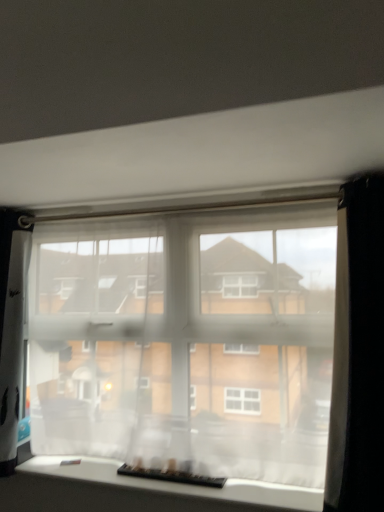
At what (x,y) coordinates should I click in order to perform the action: click on vacant area that lies between black plastic keyboard at lower center and translucent fabric at center, which appears as the 2th window when ordered from the bottom. Please return your answer as a coordinate pair (x, y). The height and width of the screenshot is (512, 384). Looking at the image, I should click on (207, 480).